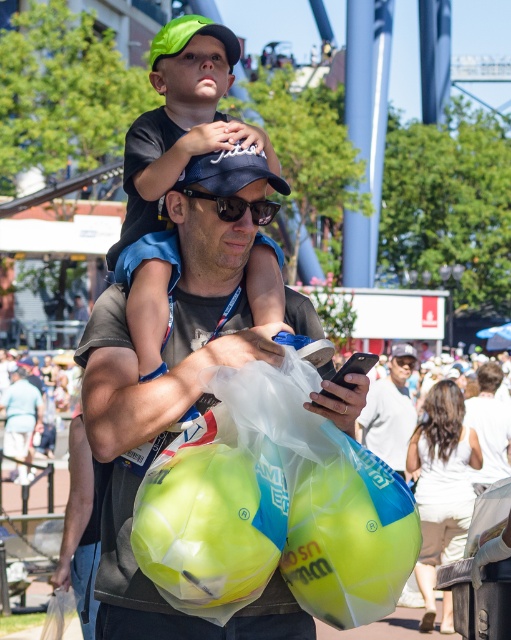
Question: Estimate the real-world distances between objects in this image. Which object is farther from the translucent yellow beach ball at center?

Choices:
 (A) matte blue baseball cap at center
 (B) matte black phone at center
 (C) green matte cap at center

Answer: (A)

Question: Can you confirm if matte black cap at center is positioned below neon yellow plastic beach ball at lower center?

Choices:
 (A) no
 (B) yes

Answer: (A)

Question: Which object is positioned farthest from the matte black cap at center?

Choices:
 (A) green matte cap at center
 (B) translucent yellow beach ball at center
 (C) sunglasses at center
 (D) neon yellow plastic beach ball at lower center

Answer: (B)

Question: Where is matte blue baseball cap at center located in relation to sunglasses at center in the image?

Choices:
 (A) right
 (B) left

Answer: (A)

Question: Is matte black cap at center above neon yellow plastic beach ball at lower center?

Choices:
 (A) no
 (B) yes

Answer: (B)

Question: Which point is closer to the camera?

Choices:
 (A) (89, 324)
 (B) (274, 308)
 (C) (210, 198)

Answer: (C)